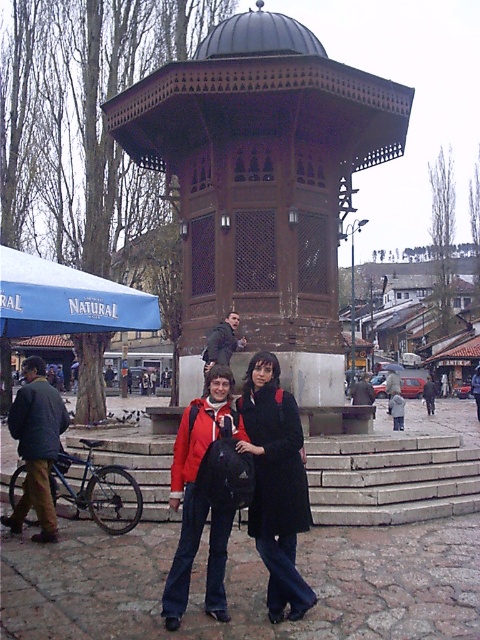
Is dark blue jacket at left thinner than dark brown wooden bench at center?

Incorrect, dark blue jacket at left's width is not less than dark brown wooden bench at center's.

What do you see at coordinates (36, 448) in the screenshot? The width and height of the screenshot is (480, 640). I see `dark blue jacket at left` at bounding box center [36, 448].

You are a GUI agent. You are given a task and a screenshot of the screen. Output one action in this format:
    pyautogui.click(x=<x>, y=<y>)
    Task: Click on the dark blue jacket at left
    The image size is (480, 640).
    Given the screenshot: What is the action you would take?
    pyautogui.click(x=36, y=448)

Who is positioned more to the left, brown wooden gazebo at center or matte red jacket at center?

brown wooden gazebo at center

Is brown wooden gazebo at center bigger than matte red jacket at center?

No, brown wooden gazebo at center is not bigger than matte red jacket at center.

From the picture: Who is more forward, (130, 106) or (213, 394)?

Positioned in front is point (213, 394).

You are a GUI agent. You are given a task and a screenshot of the screen. Output one action in this format:
    pyautogui.click(x=<x>, y=<y>)
    Task: Click on the brown wooden gazebo at center
    The height and width of the screenshot is (640, 480).
    Given the screenshot: What is the action you would take?
    pyautogui.click(x=263, y=184)

Looking at this image, does brown wooden gazebo at center have a larger size compared to dark blue jacket at left?

Incorrect, brown wooden gazebo at center is not larger than dark blue jacket at left.

Can you confirm if brown wooden gazebo at center is positioned below dark blue jacket at left?

No.

This screenshot has height=640, width=480. Identify the location of brown wooden gazebo at center. (263, 184).

The width and height of the screenshot is (480, 640). I want to click on brown wooden gazebo at center, so click(263, 184).